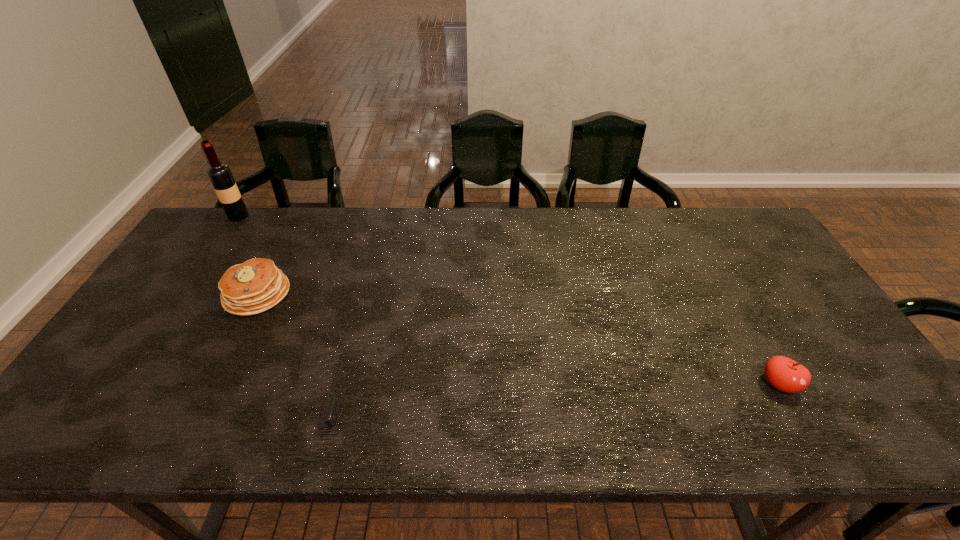
Where is `vacant space in between the pancake and the leftmost object`? This screenshot has width=960, height=540. vacant space in between the pancake and the leftmost object is located at coordinates (248, 255).

Identify the location of empty location between the shortest object and the wine bottle. The width and height of the screenshot is (960, 540). (266, 319).

This screenshot has height=540, width=960. Find the location of `empty location between the third object from right to left and the nearest object`. empty location between the third object from right to left and the nearest object is located at coordinates (275, 358).

You are a GUI agent. You are given a task and a screenshot of the screen. Output one action in this format:
    pyautogui.click(x=<x>, y=<y>)
    Task: Click on the vacant area that lies between the second nearest object and the third object from right to left
    
    Given the screenshot: What is the action you would take?
    pyautogui.click(x=517, y=339)

Locate an element on the screen. The height and width of the screenshot is (540, 960). free space between the shortest object and the farthest object is located at coordinates (266, 319).

Where is `vacant region between the second nearest object and the nearest object`? Image resolution: width=960 pixels, height=540 pixels. vacant region between the second nearest object and the nearest object is located at coordinates pos(536,403).

The image size is (960, 540). Find the location of `unoccupied position between the apple and the second object from right to left`. unoccupied position between the apple and the second object from right to left is located at coordinates (536, 403).

I want to click on vacant point located between the third farthest object and the second farthest object, so click(517, 339).

You are a GUI agent. You are given a task and a screenshot of the screen. Output one action in this format:
    pyautogui.click(x=<x>, y=<y>)
    Task: Click on the vacant space that is in between the farthest object and the rightmost object
    This screenshot has height=540, width=960.
    Given the screenshot: What is the action you would take?
    pyautogui.click(x=509, y=300)

Select which object is the closest to the nearest object. Please provide its 2D coordinates. Your answer should be formatted as a tuple, i.e. [(x, y)], where the tuple contains the x and y coordinates of a point satisfying the conditions above.

[(257, 285)]